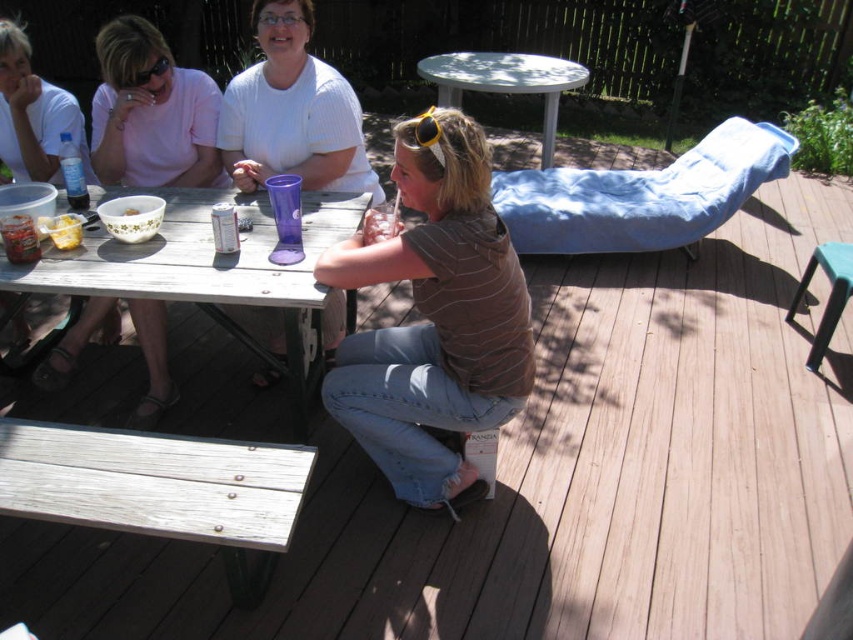
Is wooden deck at center thinner than blue fabric chaise at right?

No, wooden deck at center is not thinner than blue fabric chaise at right.

Does wooden deck at center lie in front of blue fabric chaise at right?

That is True.

This screenshot has width=853, height=640. Describe the element at coordinates (554, 477) in the screenshot. I see `wooden deck at center` at that location.

Identify the location of wooden deck at center. (554, 477).

Is point (189, 234) positioned after point (77, 227)?

That is True.

The width and height of the screenshot is (853, 640). In order to click on wooden picnic table at lower left in this screenshot , I will do `click(196, 284)`.

The height and width of the screenshot is (640, 853). I want to click on wooden picnic table at lower left, so click(196, 284).

I want to click on wooden picnic table at lower left, so click(x=196, y=284).

In the scene shown: Between blue fabric chaise at right and yellow reflective sunglasses at center, which one is positioned lower?

yellow reflective sunglasses at center is below.

Which is behind, point (520, 179) or point (421, 131)?

The point (520, 179) is more distant.

What are the coordinates of `blue fabric chaise at right` in the screenshot? It's located at (642, 195).